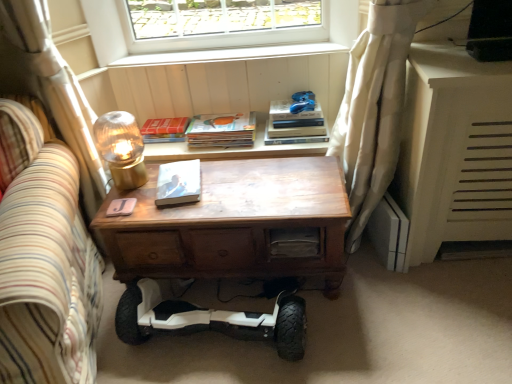
At what (x,y) coordinates should I click in order to perform the action: click on free location above white wood window sill at upper center (from a real-world perspective). Please return your answer as a coordinate pair (x, y). The height and width of the screenshot is (384, 512). Looking at the image, I should click on (211, 50).